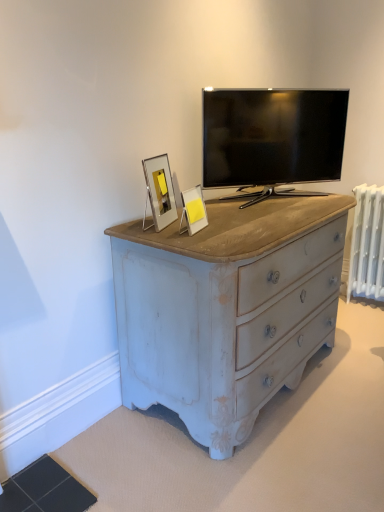
Question: Is point (240, 96) closer or farther from the camera than point (198, 203)?

Choices:
 (A) closer
 (B) farther

Answer: (B)

Question: Is black glossy tv at upper center spatially inside matte white picture frame at center, which appears as the second picture frame when viewed from the left, or outside of it?

Choices:
 (A) inside
 (B) outside

Answer: (B)

Question: Which of these objects is positioned closest to the matte white picture frame at center, the first picture frame when ordered from right to left?

Choices:
 (A) white painted metal radiator at right
 (B) black glossy tv at upper center
 (C) silver metallic picture frame at upper center, the second picture frame from the right

Answer: (C)

Question: Which is farther from the silver metallic picture frame at upper center, the second picture frame from the right?

Choices:
 (A) matte white picture frame at center, which appears as the second picture frame when viewed from the left
 (B) black glossy tv at upper center
 (C) white painted metal radiator at right

Answer: (C)